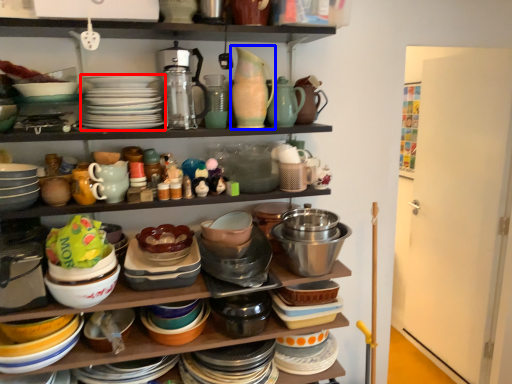
Question: Among these objects, which one is farthest to the camera, platter (highlighted by a red box) or tableware (highlighted by a blue box)?

Choices:
 (A) platter
 (B) tableware

Answer: (B)